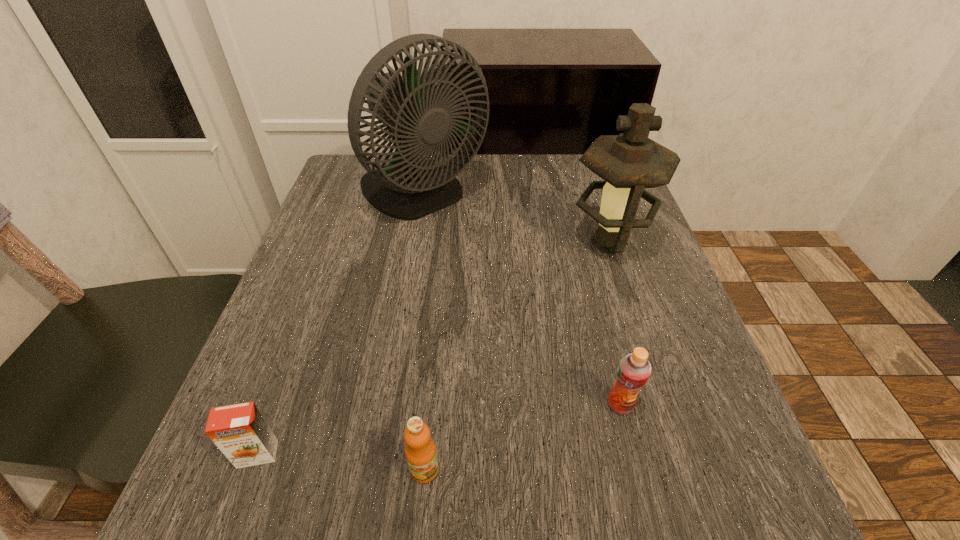
Find the location of `vacant point located on the right of the leftmost orange juice`. vacant point located on the right of the leftmost orange juice is located at coordinates (479, 454).

The width and height of the screenshot is (960, 540). In order to click on object that is at the far edge in this screenshot , I will do `click(419, 119)`.

This screenshot has height=540, width=960. In order to click on object that is positioned at the near edge in this screenshot , I will do `click(420, 451)`.

The height and width of the screenshot is (540, 960). What are the coordinates of `fan present at the left edge` in the screenshot? It's located at (419, 119).

This screenshot has height=540, width=960. Identify the location of orange juice located at the left edge. (240, 431).

Identify the location of oil lamp that is at the right edge. Image resolution: width=960 pixels, height=540 pixels. (629, 162).

The image size is (960, 540). I want to click on orange juice positioned at the right edge, so point(633,371).

The height and width of the screenshot is (540, 960). Identify the location of object that is at the far left corner. (419, 119).

Locate an element on the screen. This screenshot has width=960, height=540. vacant space at the far edge of the desktop is located at coordinates (500, 168).

The image size is (960, 540). In the image, there is a desktop. What are the coordinates of `vacant space at the near edge` in the screenshot? It's located at (556, 519).